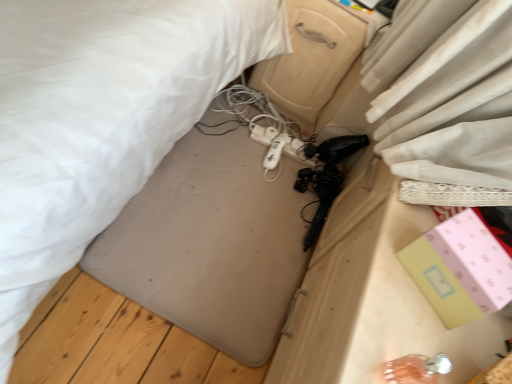
Locate an element on the screen. The image size is (512, 384). free space on the front side of white plastic hairdryer at center is located at coordinates (256, 183).